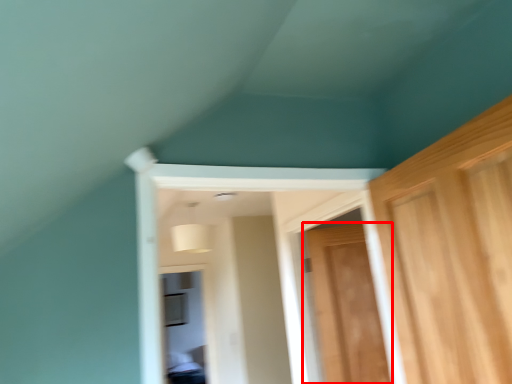
Question: From the image's perspective, where is door (annotated by the red box) located relative to window?

Choices:
 (A) below
 (B) above

Answer: (B)